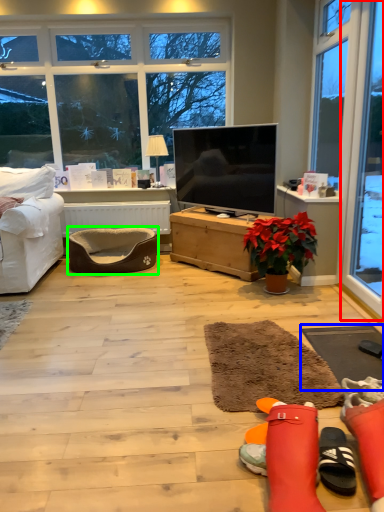
Question: Which object is positioned farthest from window (highlighted by a red box)? Select from flat (highlighted by a blue box) and footrest (highlighted by a green box).

Choices:
 (A) flat
 (B) footrest

Answer: (B)